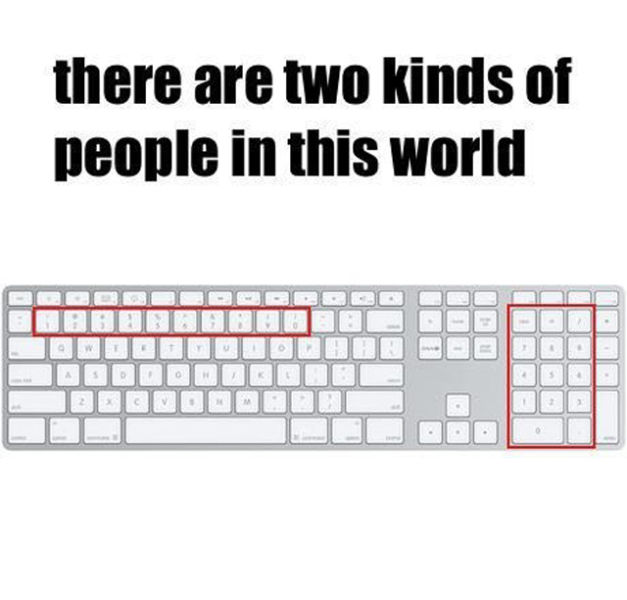
Image resolution: width=627 pixels, height=600 pixels. I want to click on rounded rectangular keyboard, so click(x=406, y=385).